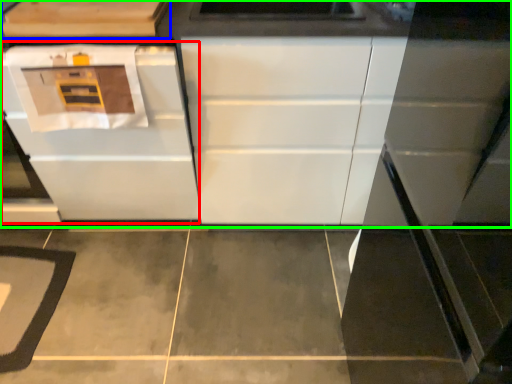
Question: Based on their relative distances, which object is farther from oven (highlighted by a red box)? Choose from cabinetry (highlighted by a blue box) and cabinetry (highlighted by a green box).

Choices:
 (A) cabinetry
 (B) cabinetry

Answer: (A)